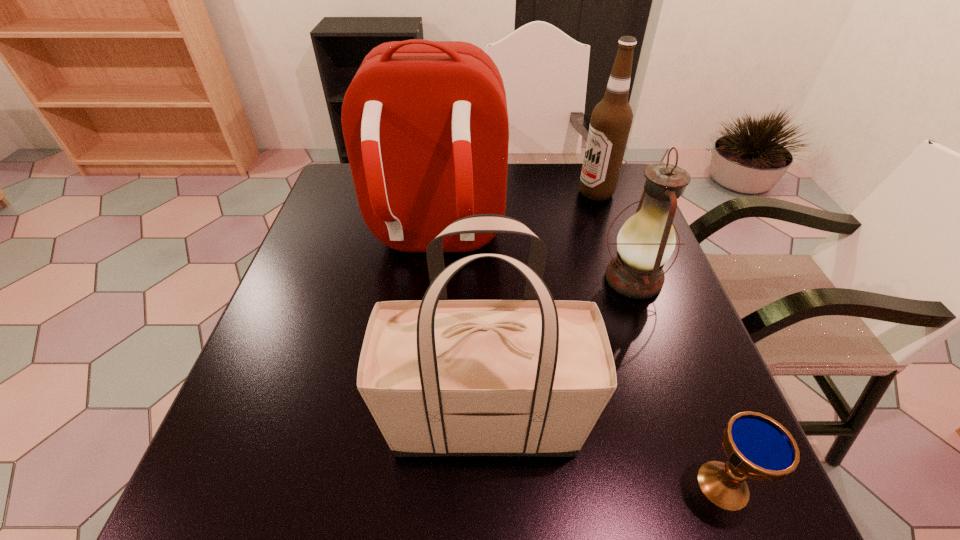
This screenshot has width=960, height=540. I want to click on backpack, so click(425, 123).

This screenshot has width=960, height=540. Find the location of `alcohol`. alcohol is located at coordinates (611, 119).

I want to click on shopping bag, so click(x=531, y=377).

You are a GUI agent. You are given a task and a screenshot of the screen. Output one action in this format:
    pyautogui.click(x=<x>, y=<y>)
    Task: Click on the second shortest object
    The height and width of the screenshot is (540, 960).
    Given the screenshot: What is the action you would take?
    pyautogui.click(x=646, y=241)

Identify the location of chalice. (758, 447).

Find the location of a particular element. This screenshot has width=960, height=540. vacant space located 0.070m on the strap side of the backpack is located at coordinates (426, 305).

The image size is (960, 540). I want to click on free point located 0.200m on the label of the alcohol, so click(510, 193).

Image resolution: width=960 pixels, height=540 pixels. In order to click on free space located on the label of the alcohol in this screenshot , I will do `click(471, 193)`.

I want to click on vacant position located 0.310m on the label of the alcohol, so click(471, 193).

Locate an element on the screen. This screenshot has width=960, height=540. vacant space positioned 0.150m with handles facing forward on the shopping bag is located at coordinates (300, 421).